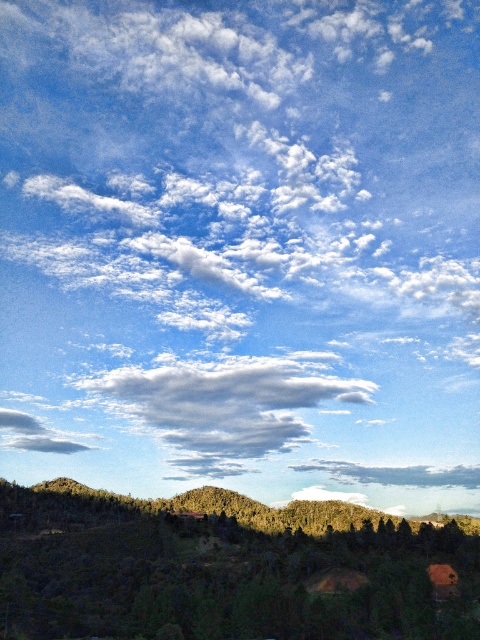
Can you confirm if green textured hillside at lower left is bigger than cloudy sky at center?

Indeed, green textured hillside at lower left has a larger size compared to cloudy sky at center.

In the scene shown: Is green textured hillside at lower left shorter than cloudy sky at center?

Yes, green textured hillside at lower left is shorter than cloudy sky at center.

Is point (63, 560) positioned after point (317, 388)?

No.

Locate an element on the screen. The image size is (480, 640). green textured hillside at lower left is located at coordinates (225, 568).